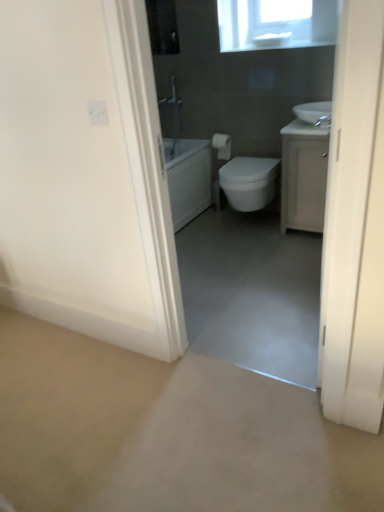
Image resolution: width=384 pixels, height=512 pixels. What are the coordinates of `vacant space in front of white glossy cabinet at right` in the screenshot? It's located at tap(300, 250).